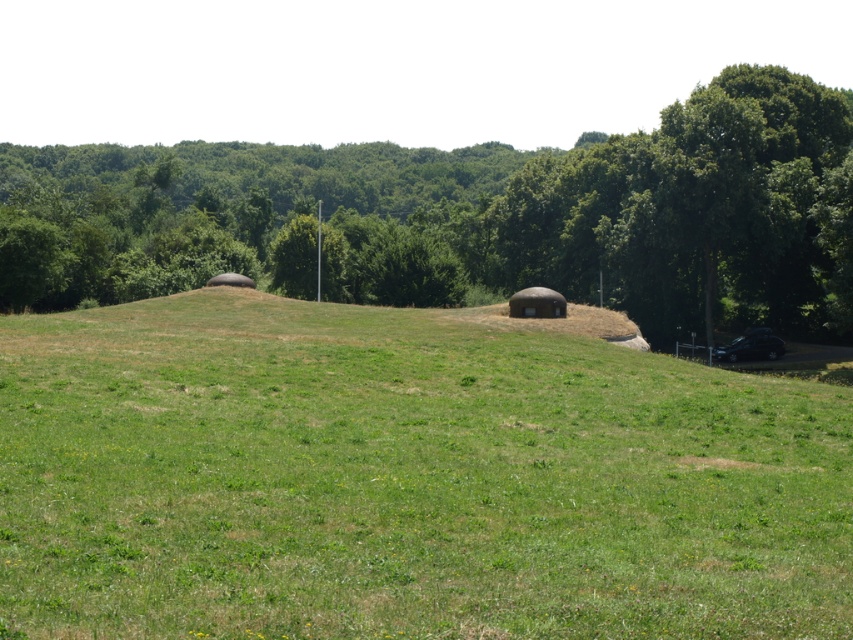
Question: Can you confirm if green grassy hill at center is thinner than green leafy tree at center?

Choices:
 (A) no
 (B) yes

Answer: (B)

Question: Is green grassy hill at center positioned behind green leafy tree at center?

Choices:
 (A) yes
 (B) no

Answer: (B)

Question: Among these objects, which one is nearest to the camera?

Choices:
 (A) green grassy hill at center
 (B) green leafy tree at center

Answer: (A)

Question: Can you confirm if green grassy hill at center is positioned to the left of green leafy tree at center?

Choices:
 (A) no
 (B) yes

Answer: (A)